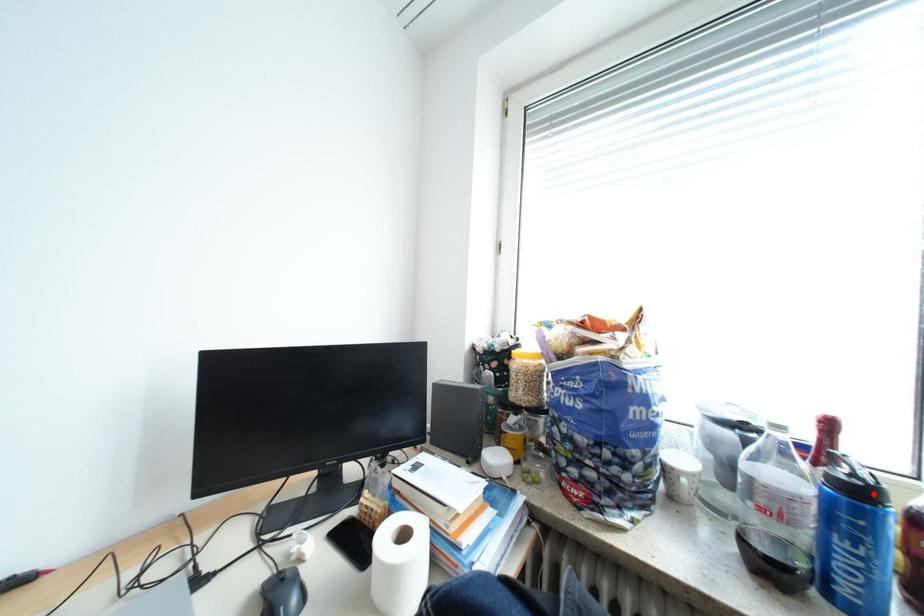
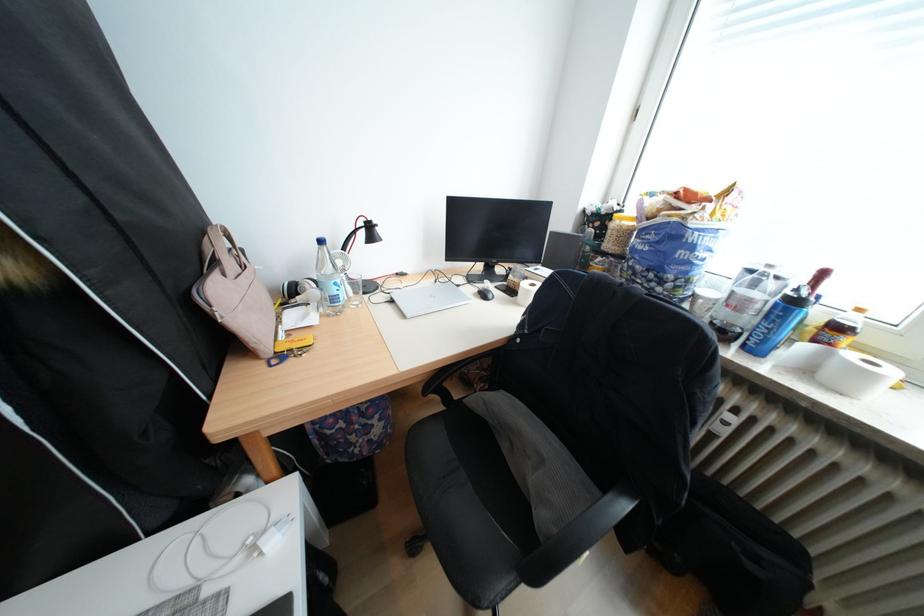
Question: I am providing you with two images of the same scene from different viewpoints. In image1, a red point is highlighted. Considering the same 3D point in image2, which of the following is correct?

Choices:
 (A) It is closer
 (B) It is farther

Answer: (B)